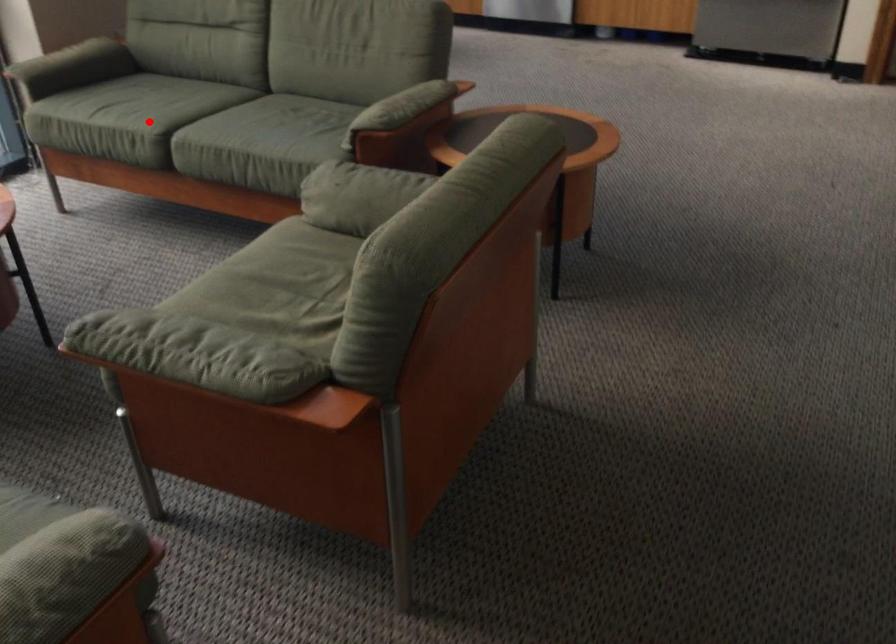
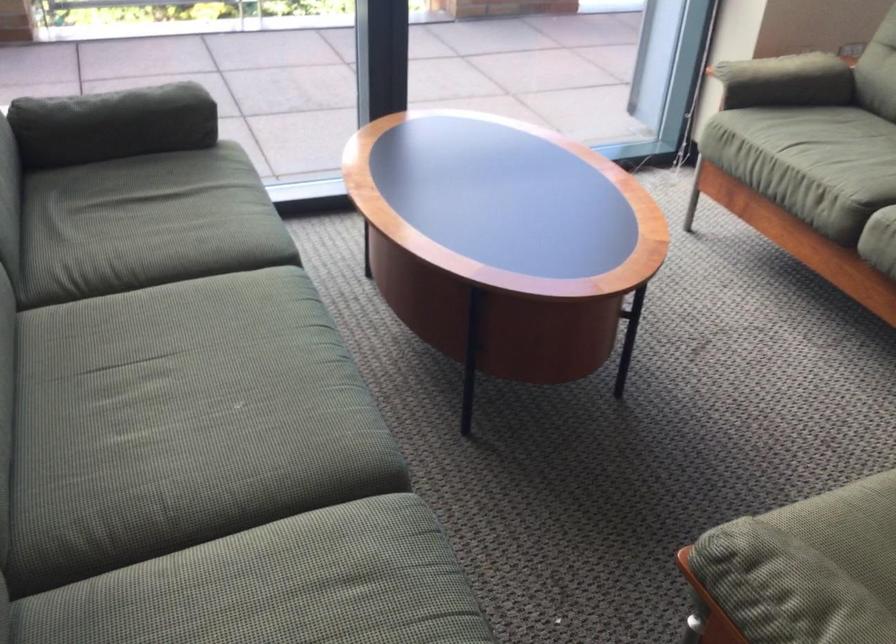
Question: I am providing you with two images of the same scene from different viewpoints. In image1, a red point is highlighted. Considering the same 3D point in image2, which of the following is correct?

Choices:
 (A) It is closer
 (B) It is farther

Answer: (A)